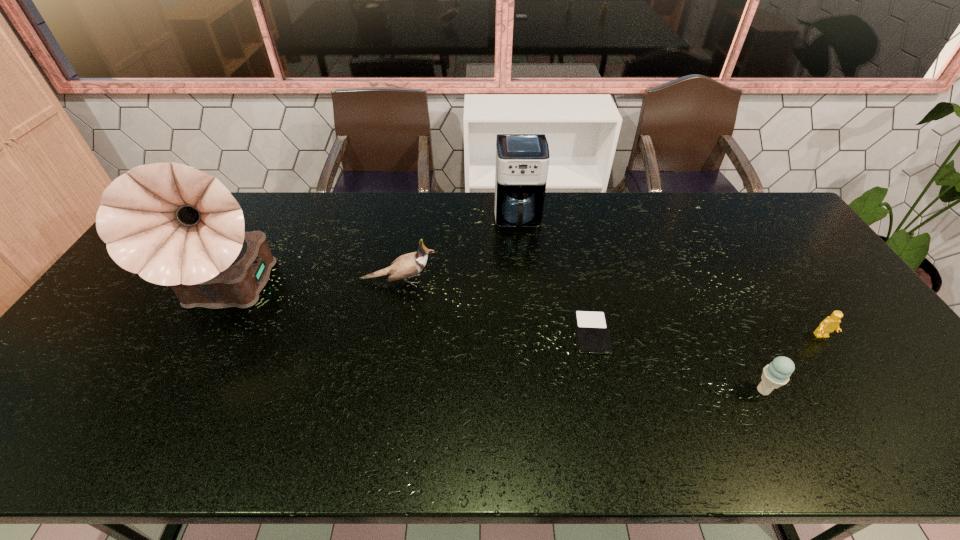
I want to click on the leftmost object, so click(173, 225).

Image resolution: width=960 pixels, height=540 pixels. I want to click on the tallest object, so click(173, 225).

In order to click on the fourth object from right to left in this screenshot , I will do `click(522, 160)`.

Identify the location of coffee maker. This screenshot has height=540, width=960. (522, 160).

This screenshot has width=960, height=540. Find the location of `bird`. bird is located at coordinates (408, 265).

I want to click on the fifth object from right to left, so click(408, 265).

The width and height of the screenshot is (960, 540). I want to click on the fifth object from left to right, so click(776, 374).

Image resolution: width=960 pixels, height=540 pixels. Identify the location of ice cream. (776, 374).

In order to click on the rightmost object in this screenshot , I will do `click(831, 323)`.

The width and height of the screenshot is (960, 540). What are the coordinates of `the fifth tallest object` in the screenshot? It's located at (831, 323).